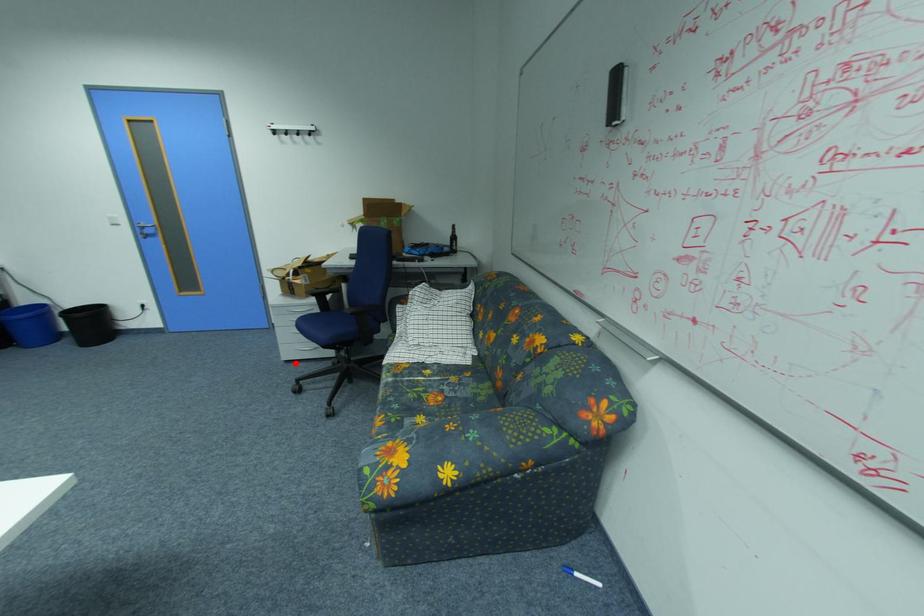
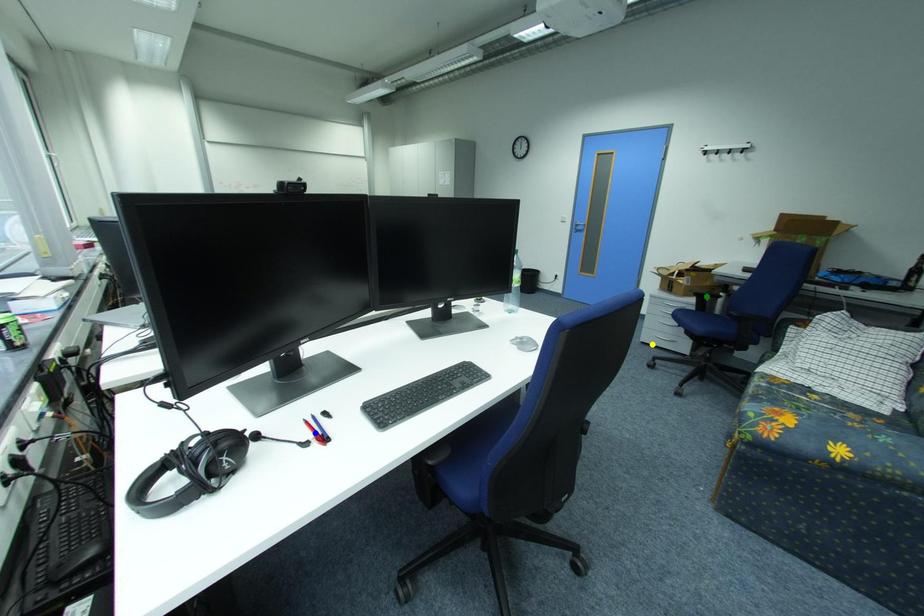
Question: I am providing you with two images of the same scene from different viewpoints. A red point is marked on the first image. You are given multiple points on the second image. Which point in image 2 represents the same 3d spot as the red point in image 1?

Choices:
 (A) green point
 (B) yellow point
 (C) blue point

Answer: (B)